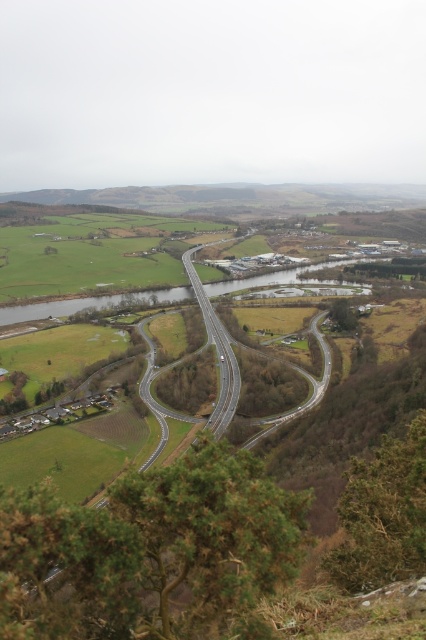
Which is behind, point (178, 298) or point (189, 257)?

Positioned behind is point (189, 257).

Which is more to the left, green grassy river at center or smooth asphalt highway at center?

smooth asphalt highway at center

Is point (216, 289) positioned before point (229, 396)?

No, it is behind (229, 396).

The width and height of the screenshot is (426, 640). Identify the location of green grassy river at center. (91, 305).